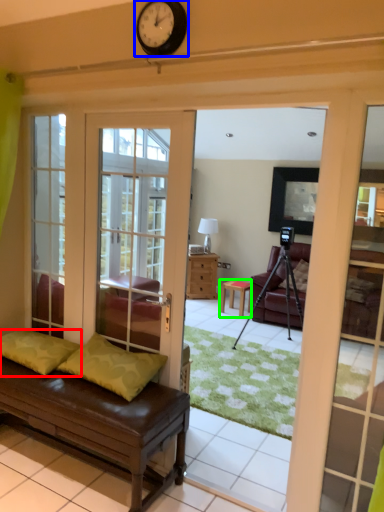
Question: Which is nearer to the pillow (highlighted by a red box)? clock (highlighted by a blue box) or table (highlighted by a green box).

Choices:
 (A) clock
 (B) table

Answer: (A)